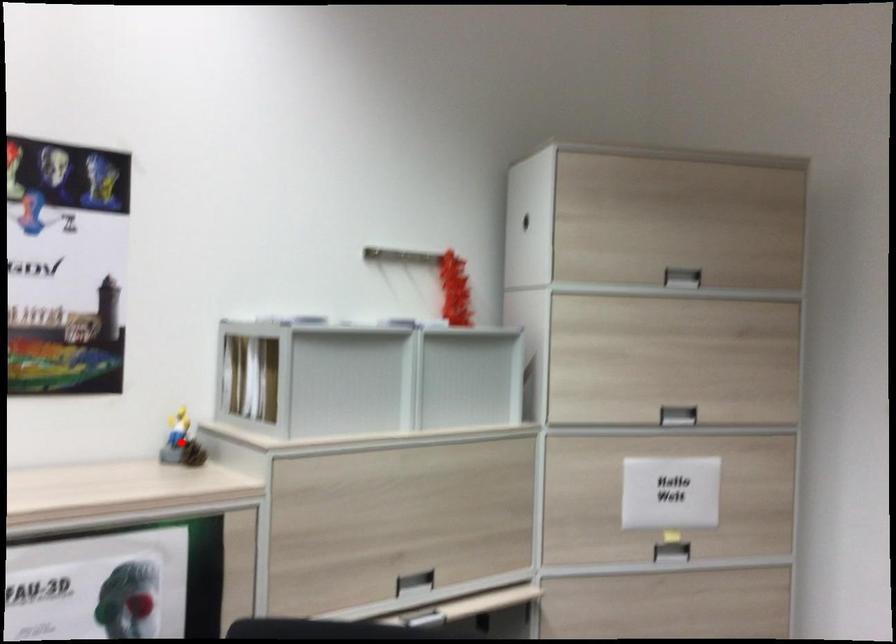
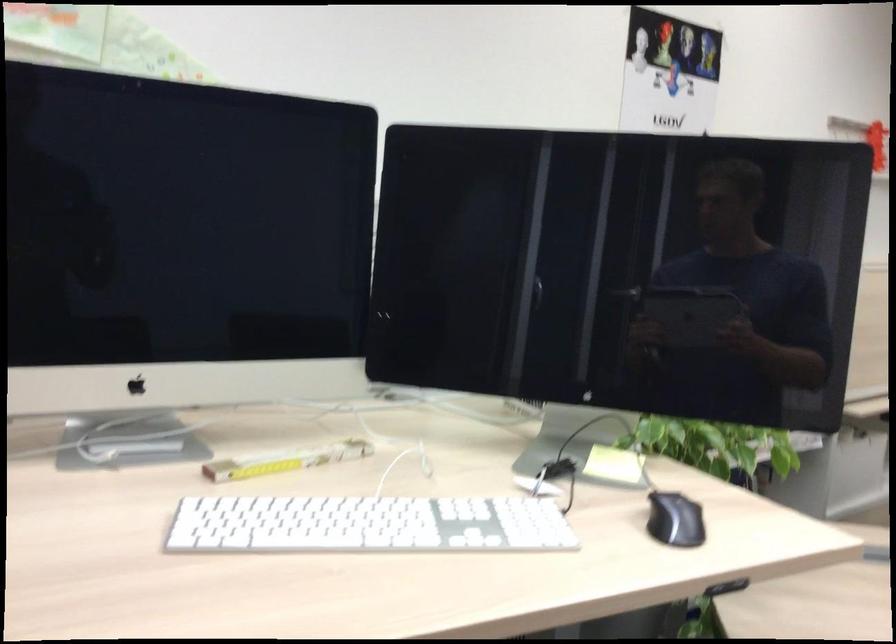
Question: I am providing you with two images of the same scene from different viewpoints. A red point is marked on the first image. Is the red point's position out of view in image 2?

Choices:
 (A) Yes
 (B) No

Answer: (A)